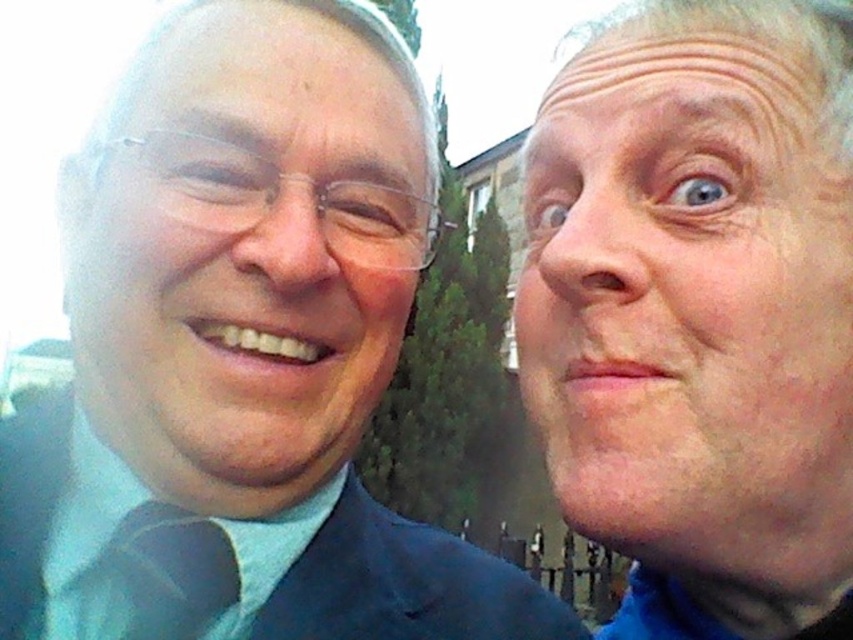
Question: Is pale skin at right wider than dark blue fabric suit at left?

Choices:
 (A) no
 (B) yes

Answer: (A)

Question: Which of the following is the farthest from the observer?

Choices:
 (A) pale skin at right
 (B) matte black face at left
 (C) dark blue fabric suit at left

Answer: (C)

Question: Which point is closer to the camera?

Choices:
 (A) matte blue tie at left
 (B) pale skin at right

Answer: (B)

Question: Does pale skin at right appear on the right side of dark blue fabric suit at left?

Choices:
 (A) yes
 (B) no

Answer: (A)

Question: Which of the following is the closest to the observer?

Choices:
 (A) (769, 234)
 (B) (351, 636)
 (C) (166, 608)

Answer: (A)

Question: Does pale skin at right have a smaller size compared to matte black face at left?

Choices:
 (A) yes
 (B) no

Answer: (A)